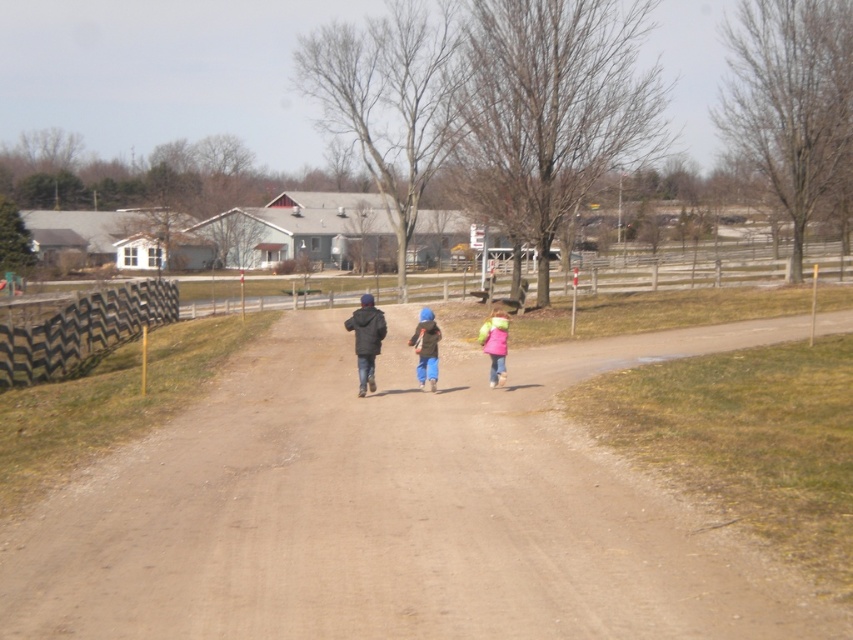
Question: Based on their relative distances, which object is farther from the blue denim pants at center?

Choices:
 (A) brown dirt track at center
 (B) pink fleece jacket at center

Answer: (A)

Question: Which of the following is the closest to the observer?

Choices:
 (A) brown dirt track at center
 (B) blue denim pants at center
 (C) pink fleece jacket at center

Answer: (A)

Question: In this image, where is blue denim pants at center located relative to pink fleece jacket at center?

Choices:
 (A) below
 (B) above

Answer: (A)

Question: Which of the following is the closest to the observer?

Choices:
 (A) (496, 314)
 (B) (123, 541)
 (C) (421, 349)

Answer: (B)

Question: From the image, what is the correct spatial relationship of blue denim pants at center in relation to pink fleece jacket at center?

Choices:
 (A) below
 (B) above

Answer: (A)

Question: Is blue denim pants at center positioned at the back of pink fleece jacket at center?

Choices:
 (A) no
 (B) yes

Answer: (A)